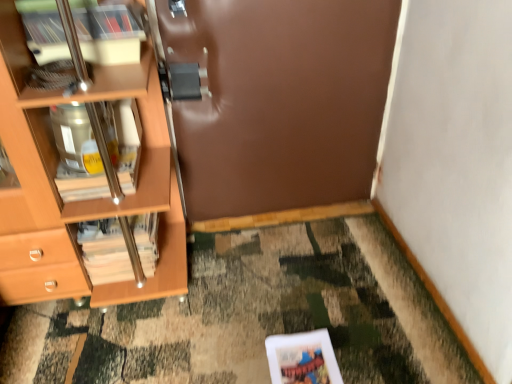
Question: From a real-world perspective, is wooden/matte magazine at left located beneath brown matte door at center?

Choices:
 (A) yes
 (B) no

Answer: (A)

Question: From the image's perspective, is wooden/matte magazine at left over brown matte door at center?

Choices:
 (A) yes
 (B) no

Answer: (B)

Question: Is wooden/matte magazine at left positioned before brown matte door at center?

Choices:
 (A) no
 (B) yes

Answer: (A)

Question: Can you see wooden/matte magazine at left touching brown matte door at center?

Choices:
 (A) no
 (B) yes

Answer: (A)

Question: Does wooden/matte magazine at left have a lesser height compared to brown matte door at center?

Choices:
 (A) no
 (B) yes

Answer: (B)

Question: Looking at the image, does brown matte door at center seem bigger or smaller compared to wooden/matte magazine at left?

Choices:
 (A) big
 (B) small

Answer: (A)

Question: Considering the positions of brown matte door at center and wooden/matte magazine at left in the image, is brown matte door at center wider or thinner than wooden/matte magazine at left?

Choices:
 (A) thin
 (B) wide

Answer: (A)

Question: Considering the positions of brown matte door at center and wooden/matte magazine at left in the image, is brown matte door at center taller or shorter than wooden/matte magazine at left?

Choices:
 (A) tall
 (B) short

Answer: (A)

Question: Is point (358, 43) closer or farther from the camera than point (142, 248)?

Choices:
 (A) farther
 (B) closer

Answer: (A)

Question: Would you say brown matte door at center is inside or outside wooden cabinet at left?

Choices:
 (A) outside
 (B) inside

Answer: (A)

Question: In the image, is brown matte door at center positioned in front of or behind wooden cabinet at left?

Choices:
 (A) behind
 (B) front

Answer: (A)

Question: From a real-world perspective, relative to wooden cabinet at left, is brown matte door at center vertically above or below?

Choices:
 (A) above
 (B) below

Answer: (B)

Question: In terms of height, does brown matte door at center look taller or shorter compared to wooden cabinet at left?

Choices:
 (A) short
 (B) tall

Answer: (B)

Question: Relative to wooden/matte magazine at left, is wooden cabinet at left in front or behind?

Choices:
 (A) front
 (B) behind

Answer: (A)

Question: From the image's perspective, is wooden cabinet at left above or below wooden/matte magazine at left?

Choices:
 (A) below
 (B) above

Answer: (B)